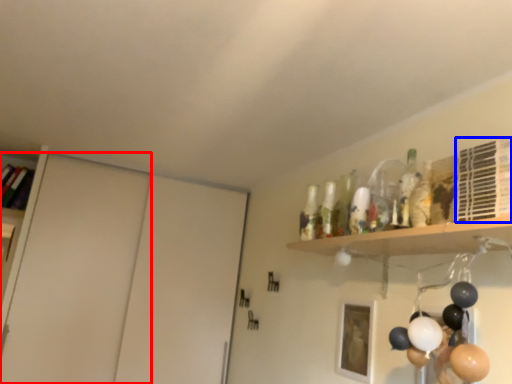
Question: Which point is further to the camera, door (highlighted by a red box) or shelf (highlighted by a blue box)?

Choices:
 (A) door
 (B) shelf

Answer: (A)